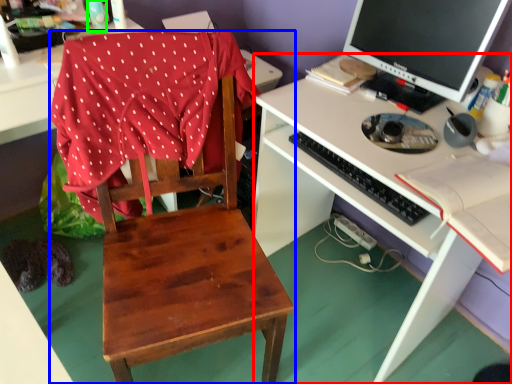
Question: Based on their relative distances, which object is farther from desk (highlighted by a red box)? Choose from chair (highlighted by a blue box) and bottle (highlighted by a green box).

Choices:
 (A) chair
 (B) bottle

Answer: (B)